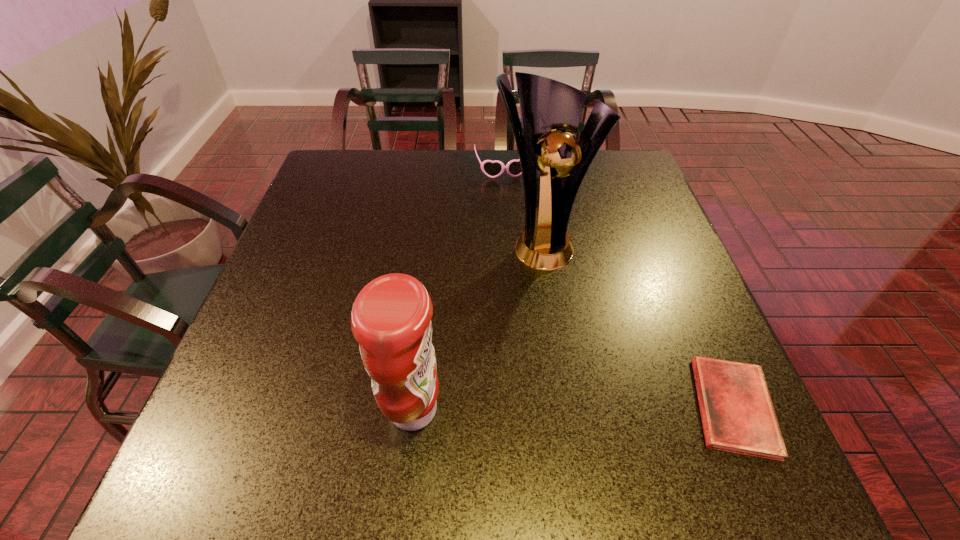
At what (x,y) coordinates should I click in order to perform the action: click on vacant space positioned on the front-facing side of the farthest object. Please return your answer as a coordinate pair (x, y). Image resolution: width=960 pixels, height=540 pixels. Looking at the image, I should click on (508, 194).

You are a GUI agent. You are given a task and a screenshot of the screen. Output one action in this format:
    pyautogui.click(x=<x>, y=<y>)
    Task: Click on the free space located 0.230m on the front-facing side of the farthest object
    The image size is (960, 540).
    Given the screenshot: What is the action you would take?
    pyautogui.click(x=516, y=230)

Where is `vacant space located on the front-facing side of the farthest object`? The width and height of the screenshot is (960, 540). vacant space located on the front-facing side of the farthest object is located at coordinates (511, 207).

Locate an element on the screen. The image size is (960, 540). vacant position located 0.100m at the front of the award, where the globe is visible is located at coordinates (571, 301).

This screenshot has height=540, width=960. I want to click on blank space located at the front of the award, where the globe is visible, so click(x=578, y=315).

The width and height of the screenshot is (960, 540). Identify the location of vacant space located 0.160m at the front of the award, where the globe is visible. (581, 322).

I want to click on object that is at the far edge, so click(x=492, y=169).

Identify the location of condiment located at the near edge. The width and height of the screenshot is (960, 540). (391, 317).

Locate an element on the screen. diary situated at the near edge is located at coordinates (737, 413).

Image resolution: width=960 pixels, height=540 pixels. What are the coordinates of `object located in the right edge section of the desktop` in the screenshot? It's located at (737, 413).